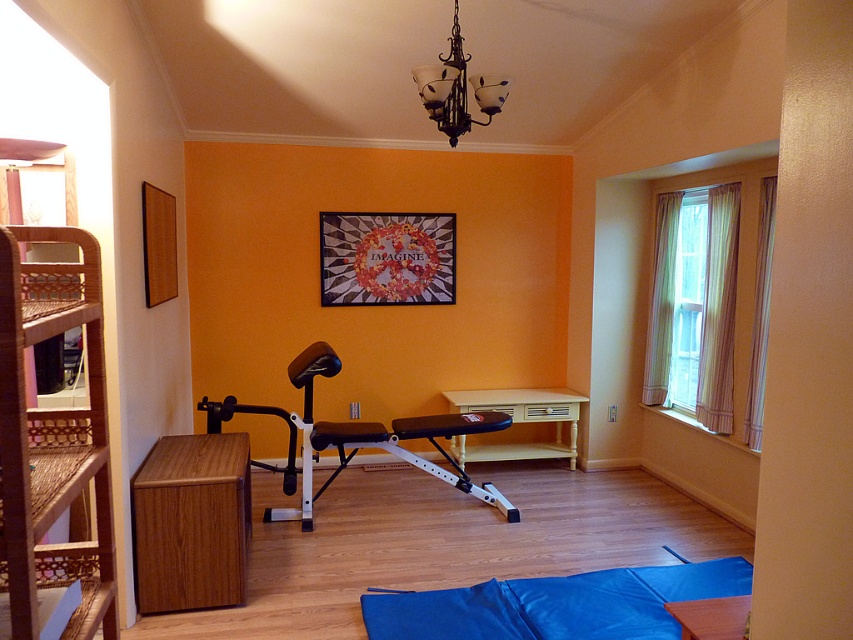
You are a fitness instructor preparing for a class. You need to place a 1.2 meter long exercise equipment between the blue fabric yoga mat at lower center and the white plastic bench at center. Is there enough space?

The distance between the blue fabric yoga mat at lower center and the white plastic bench at center is 1.02 meters, which is shorter than the 1.2 meter long equipment. Therefore, there isn not enough space to place the equipment between them.

You are a parent setting up a children room. You have a 1.2 meter wide toy box that needs to be placed between the woven wood bunk bed at left and the workout bench. Is there enough space to place the toy box between them?

The distance between the woven wood bunk bed at left and the workout bench is 1.33 meters. Since the toy box is 1.2 meters wide, there is enough space to place it between them as 1.33 meters is greater than 1.2 meters.

You are standing in the room and want to place a new yoga mat. The current yoga mat is located at point (x=556, y=604). Where should you place the new yoga mat to avoid overlapping with the existing one?

The blue fabric yoga mat at lower center is located at point (x=556, y=604). To avoid overlapping, place the new yoga mat at a different coordinate such as 0.85, 0.55.